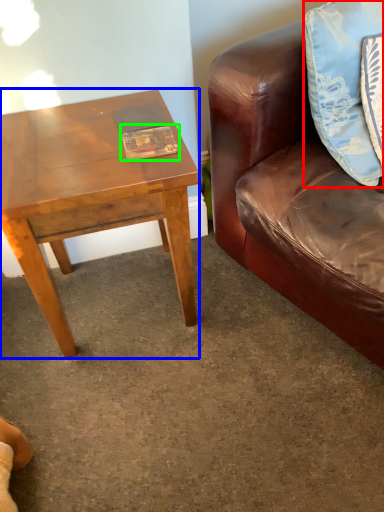
Question: Based on their relative distances, which object is nearer to pillow (highlighted by a red box)? Choose from coffee table (highlighted by a blue box) and book (highlighted by a green box).

Choices:
 (A) coffee table
 (B) book

Answer: (B)